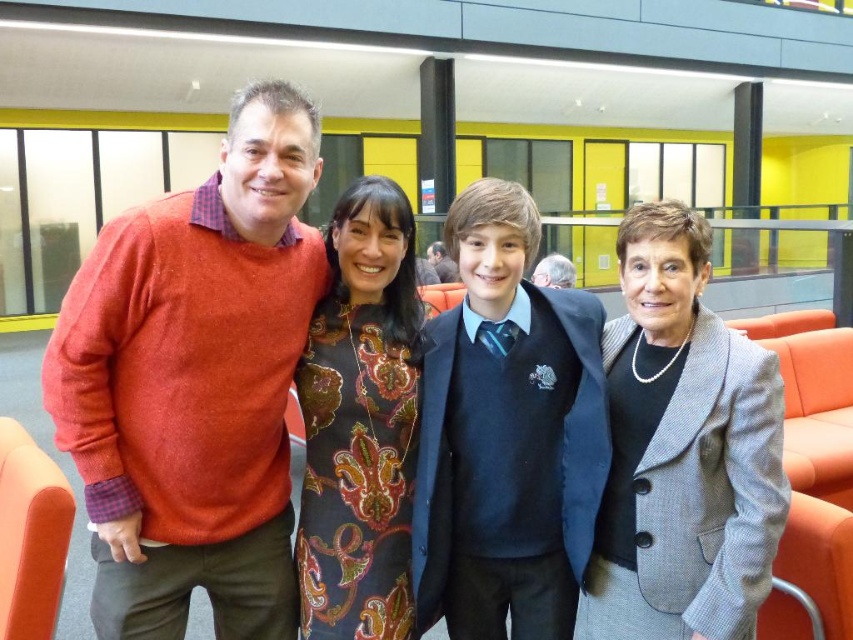
Question: Based on their relative distances, which object is nearer to the gray hair at upper center?

Choices:
 (A) matte red sweater at left
 (B) matte blue sweater at center
 (C) paisley-patterned dress at center
 (D) gray woolen blazer at center

Answer: (B)

Question: Is matte blue sweater at center wider than gray woolen blazer at center?

Choices:
 (A) yes
 (B) no

Answer: (A)

Question: Can you confirm if gray woolen blazer at center is positioned to the right of gray hair at upper center?

Choices:
 (A) yes
 (B) no

Answer: (B)

Question: Is gray woolen blazer at center above paisley-patterned dress at center?

Choices:
 (A) yes
 (B) no

Answer: (B)

Question: Which is farther from the matte blue sweater at center?

Choices:
 (A) paisley-patterned dress at center
 (B) gray hair at upper center
 (C) matte red sweater at left

Answer: (B)

Question: Considering the real-world distances, which object is farthest from the paisley-patterned dress at center?

Choices:
 (A) matte blue sweater at center
 (B) gray woolen blazer at center

Answer: (B)